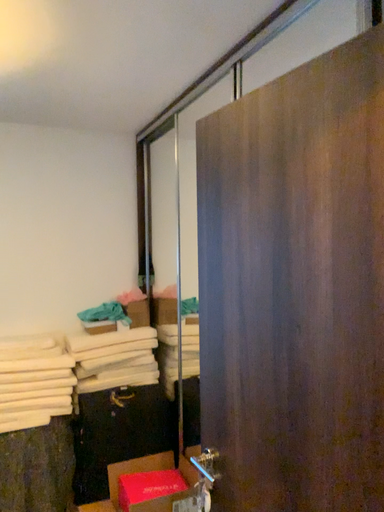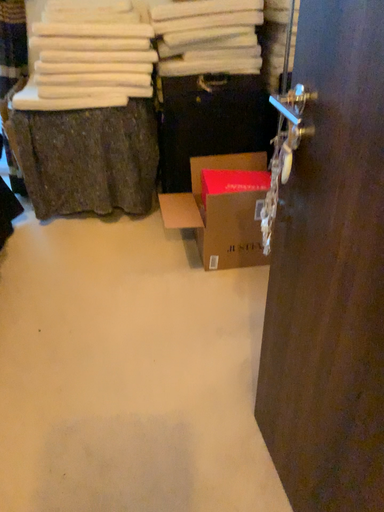
Question: Which way did the camera rotate in the video?

Choices:
 (A) rotated left
 (B) rotated right

Answer: (A)